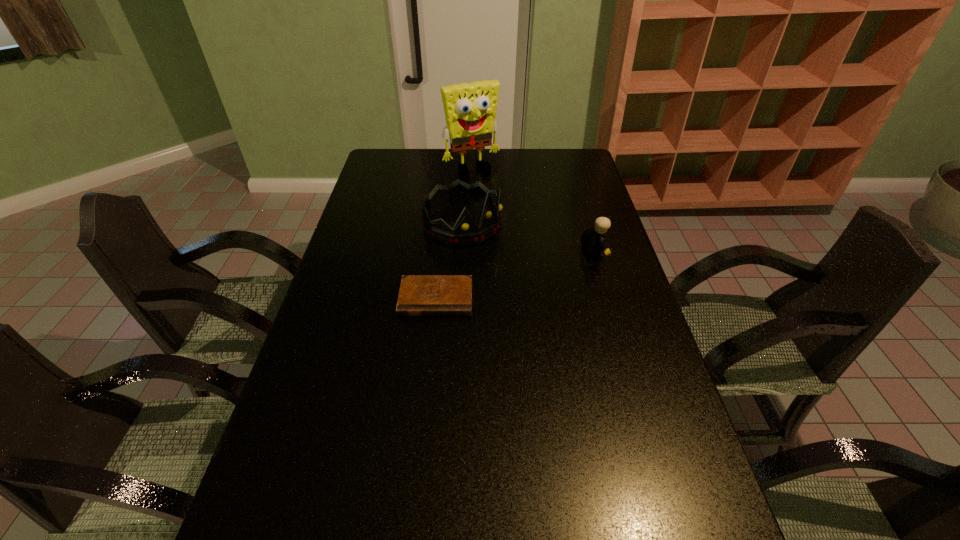
At what (x,y) coordinates should I click in order to perform the action: click on vacant area that satisfies the following two spatial constraints: 1. on the front side of the tiara; 2. on the front-facing side of the rightmost object. Please return your answer as a coordinate pair (x, y). Image resolution: width=960 pixels, height=540 pixels. Looking at the image, I should click on (461, 253).

Find the location of a particular element. Image resolution: width=960 pixels, height=540 pixels. free point that satisfies the following two spatial constraints: 1. on the front side of the Lego; 2. on the front-facing side of the tallest object is located at coordinates (469, 253).

You are a GUI agent. You are given a task and a screenshot of the screen. Output one action in this format:
    pyautogui.click(x=<x>, y=<y>)
    Task: Click on the vacant space that satisfies the following two spatial constraints: 1. on the back side of the second tallest object; 2. on the right side of the farthest object
    The height and width of the screenshot is (540, 960).
    Given the screenshot: What is the action you would take?
    pyautogui.click(x=465, y=170)